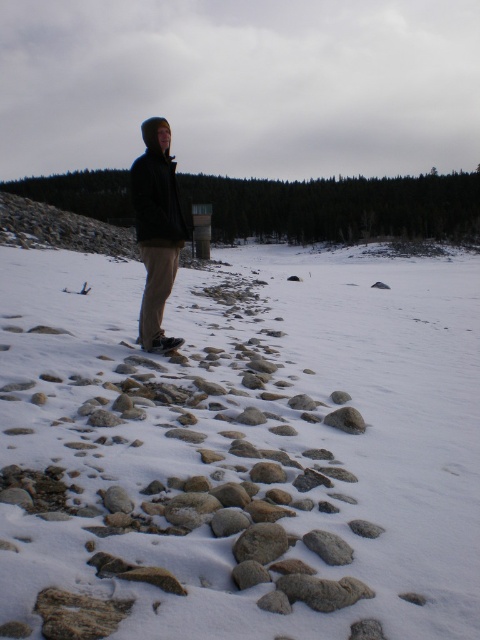
Can you confirm if white matte snow at center is taller than matte black jacket at center?

No.

Identify the location of white matte snow at center. (240, 449).

Who is higher up, matte black jacket at center or smooth gray rock at center?

matte black jacket at center

Who is taller, matte black jacket at center or smooth gray rock at center?

Standing taller between the two is matte black jacket at center.

Locate an element on the screen. The image size is (480, 640). matte black jacket at center is located at coordinates (156, 189).

Which is in front, point (168, 124) or point (316, 548)?

Point (316, 548)

Is matte black jacket at center in front of gray rough rock at lower center?

That is False.

Does point (149, 148) lie in front of point (308, 540)?

No, it is behind (308, 540).

Where is `matte black jacket at center`? The width and height of the screenshot is (480, 640). matte black jacket at center is located at coordinates (156, 189).